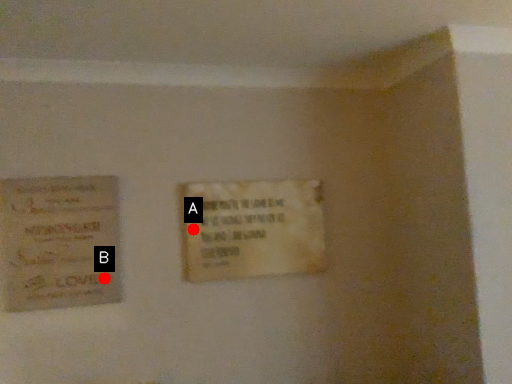
Question: Two points are circled on the image, labeled by A and B beside each circle. Which point is farther to the camera?

Choices:
 (A) A is further
 (B) B is further

Answer: (A)